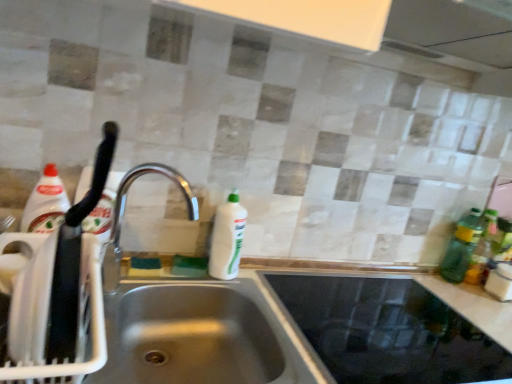
Locate an element on the screen. The image size is (512, 384). empty space that is in between green translucent bottle at right, arranged as the 2th bottle when viewed from the right, and white glossy bottle at center is located at coordinates (335, 273).